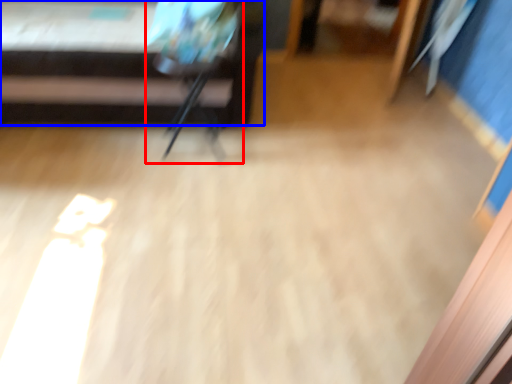
Question: Which object appears farthest to the camera in this image, armchair (highlighted by a red box) or furniture (highlighted by a blue box)?

Choices:
 (A) armchair
 (B) furniture

Answer: (A)